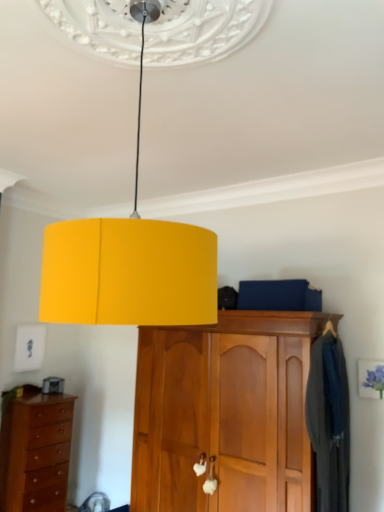
Question: Can you confirm if dark blue fabric coat at right is positioned to the right of wooden cabinet at center?

Choices:
 (A) yes
 (B) no

Answer: (A)

Question: From the image's perspective, is dark blue fabric coat at right under wooden cabinet at center?

Choices:
 (A) no
 (B) yes

Answer: (A)

Question: Is wooden cabinet at center completely or partially inside dark blue fabric coat at right?

Choices:
 (A) yes
 (B) no

Answer: (B)

Question: Considering the relative sizes of dark blue fabric coat at right and wooden cabinet at center in the image provided, is dark blue fabric coat at right smaller than wooden cabinet at center?

Choices:
 (A) no
 (B) yes

Answer: (B)

Question: Is the position of dark blue fabric coat at right less distant than that of wooden cabinet at center?

Choices:
 (A) yes
 (B) no

Answer: (B)

Question: In the image, is wooden cabinet at center on the left side or the right side of brown wooden chest of drawers at lower left?

Choices:
 (A) left
 (B) right

Answer: (B)

Question: In the image, is wooden cabinet at center positioned in front of or behind brown wooden chest of drawers at lower left?

Choices:
 (A) front
 (B) behind

Answer: (A)

Question: In terms of size, does wooden cabinet at center appear bigger or smaller than brown wooden chest of drawers at lower left?

Choices:
 (A) big
 (B) small

Answer: (A)

Question: Does point (289, 453) appear closer or farther from the camera than point (11, 478)?

Choices:
 (A) closer
 (B) farther

Answer: (A)

Question: In terms of width, does brown wooden chest of drawers at lower left look wider or thinner when compared to wooden cabinet at center?

Choices:
 (A) thin
 (B) wide

Answer: (A)

Question: Would you say brown wooden chest of drawers at lower left is to the left or to the right of wooden cabinet at center in the picture?

Choices:
 (A) right
 (B) left

Answer: (B)

Question: Considering their positions, is brown wooden chest of drawers at lower left located in front of or behind wooden cabinet at center?

Choices:
 (A) behind
 (B) front

Answer: (A)

Question: Is point (3, 444) closer or farther from the camera than point (137, 483)?

Choices:
 (A) closer
 (B) farther

Answer: (B)

Question: In terms of height, does yellow matte lampshade at center look taller or shorter compared to brown wooden chest of drawers at lower left?

Choices:
 (A) tall
 (B) short

Answer: (B)

Question: Relative to brown wooden chest of drawers at lower left, is yellow matte lampshade at center in front or behind?

Choices:
 (A) behind
 (B) front

Answer: (B)